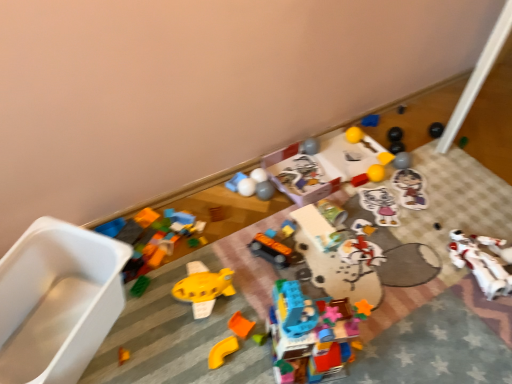
Locate an element on the screen. unoccupied region to the right of translucent plastic building blocks at center, the 9th toy positioned from the left is located at coordinates (381, 348).